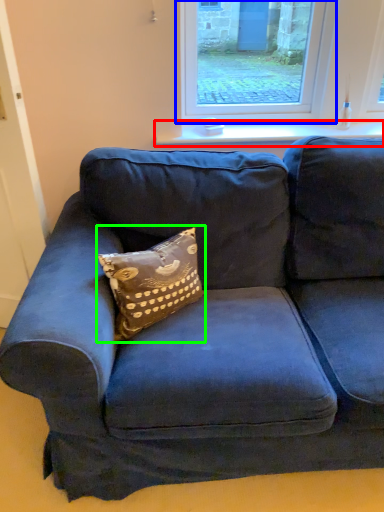
Question: Which object is the farthest from window sill (highlighted by a red box)? Choose among these: window (highlighted by a blue box) or pillow (highlighted by a green box).

Choices:
 (A) window
 (B) pillow

Answer: (B)